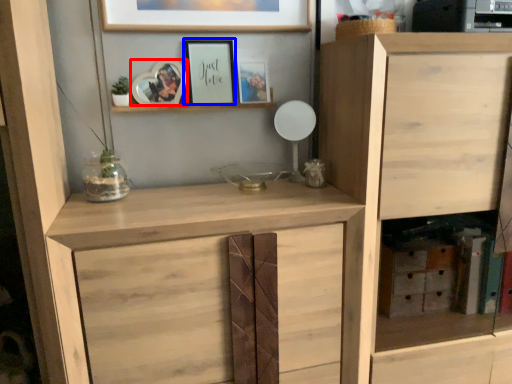
Question: Which object is closer to the camera taking this photo, picture frame (highlighted by a red box) or picture frame (highlighted by a blue box)?

Choices:
 (A) picture frame
 (B) picture frame

Answer: (A)